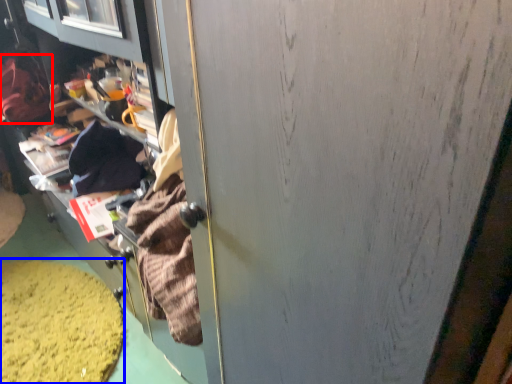
Question: Which object appears farthest to the camera in this image, clothing (highlighted by a red box) or debris (highlighted by a blue box)?

Choices:
 (A) clothing
 (B) debris

Answer: (A)